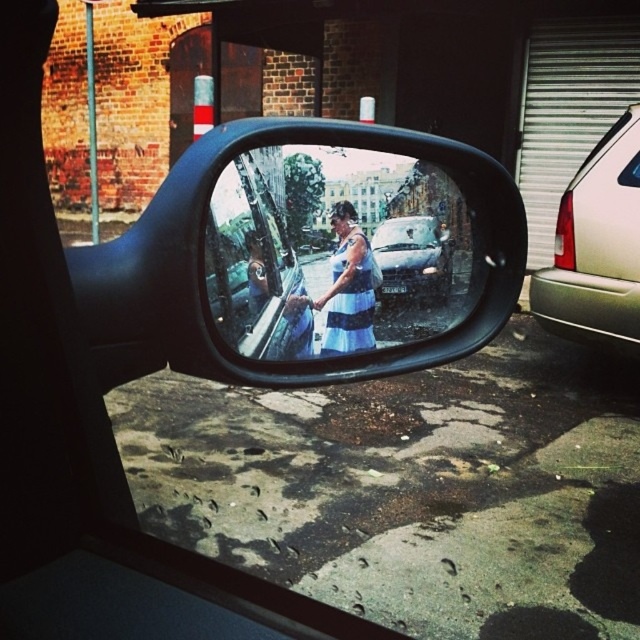
Question: Can you confirm if blue striped dress at center is smaller than metallic silver car at center?

Choices:
 (A) yes
 (B) no

Answer: (B)

Question: Among these objects, which one is nearest to the camera?

Choices:
 (A) metallic silver car at center
 (B) blue striped dress at center

Answer: (B)

Question: In this image, where is striped fabric dress at center located relative to metallic silver car at center?

Choices:
 (A) right
 (B) left

Answer: (B)

Question: Which of the following is the closest to the observer?

Choices:
 (A) (314, 260)
 (B) (387, 236)
 (C) (346, 220)

Answer: (A)

Question: Which object is farther from the camera taking this photo?

Choices:
 (A) metallic silver car at center
 (B) metallic silver car at right
 (C) blue striped dress at center

Answer: (B)

Question: Can you confirm if metallic silver car at right is bigger than striped fabric dress at center?

Choices:
 (A) no
 (B) yes

Answer: (B)